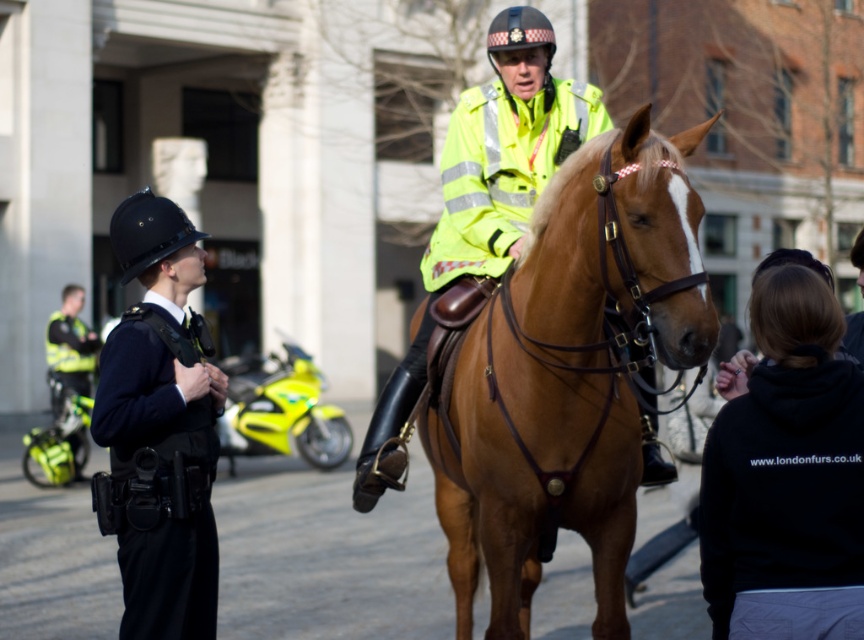
Question: Which point appears farthest from the camera in this image?

Choices:
 (A) (175, 621)
 (B) (589, 440)
 (C) (443, 236)
 (D) (715, 429)

Answer: (C)

Question: Which of the following is the closest to the observer?

Choices:
 (A) brown leather horse at center
 (B) high-visibility yellow jacket at center
 (C) dark blue uniform at left

Answer: (A)

Question: Is black fleece at lower right to the right of high-visibility yellow jacket at center from the viewer's perspective?

Choices:
 (A) no
 (B) yes

Answer: (B)

Question: From the image, what is the correct spatial relationship of black fleece at lower right in relation to dark blue uniform at left?

Choices:
 (A) above
 (B) below

Answer: (B)

Question: Which point is farther to the camera?

Choices:
 (A) dark blue uniform at left
 (B) black fleece at lower right

Answer: (A)

Question: Where is brown leather horse at center located in relation to high-visibility yellow jacket at center in the image?

Choices:
 (A) below
 (B) above

Answer: (A)